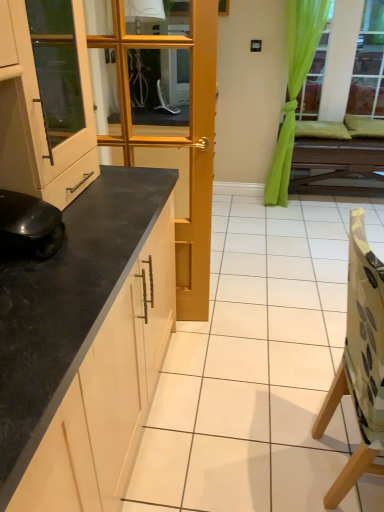
Question: Considering the relative positions of camouflage fabric chair at right and black granite countertop at left in the image provided, is camouflage fabric chair at right in front of black granite countertop at left?

Choices:
 (A) yes
 (B) no

Answer: (A)

Question: Is camouflage fabric chair at right oriented away from black granite countertop at left?

Choices:
 (A) no
 (B) yes

Answer: (B)

Question: Can you confirm if camouflage fabric chair at right is thinner than black granite countertop at left?

Choices:
 (A) no
 (B) yes

Answer: (B)

Question: From the image's perspective, is camouflage fabric chair at right above black granite countertop at left?

Choices:
 (A) yes
 (B) no

Answer: (B)

Question: From a real-world perspective, is camouflage fabric chair at right positioned over black granite countertop at left based on gravity?

Choices:
 (A) no
 (B) yes

Answer: (B)

Question: From the image's perspective, is green fabric curtain at upper right above or below black matte robot vacuum cleaner at lower left?

Choices:
 (A) below
 (B) above

Answer: (B)

Question: From a real-world perspective, is green fabric curtain at upper right positioned above or below black matte robot vacuum cleaner at lower left?

Choices:
 (A) below
 (B) above

Answer: (A)

Question: Is green fabric curtain at upper right bigger or smaller than black matte robot vacuum cleaner at lower left?

Choices:
 (A) small
 (B) big

Answer: (B)

Question: In the image, is green fabric curtain at upper right positioned in front of or behind black matte robot vacuum cleaner at lower left?

Choices:
 (A) behind
 (B) front

Answer: (A)

Question: Considering the positions of black granite countertop at left and black matte robot vacuum cleaner at lower left in the image, is black granite countertop at left wider or thinner than black matte robot vacuum cleaner at lower left?

Choices:
 (A) wide
 (B) thin

Answer: (A)

Question: From a real-world perspective, is black granite countertop at left positioned above or below black matte robot vacuum cleaner at lower left?

Choices:
 (A) below
 (B) above

Answer: (A)

Question: Considering the positions of black granite countertop at left and black matte robot vacuum cleaner at lower left in the image, is black granite countertop at left bigger or smaller than black matte robot vacuum cleaner at lower left?

Choices:
 (A) small
 (B) big

Answer: (B)

Question: Do you think black granite countertop at left is within black matte robot vacuum cleaner at lower left, or outside of it?

Choices:
 (A) inside
 (B) outside

Answer: (B)

Question: From the image's perspective, is black matte robot vacuum cleaner at lower left located above or below matte white cabinet at left?

Choices:
 (A) above
 (B) below

Answer: (B)

Question: Would you say black matte robot vacuum cleaner at lower left is to the left or to the right of matte white cabinet at left in the picture?

Choices:
 (A) right
 (B) left

Answer: (A)